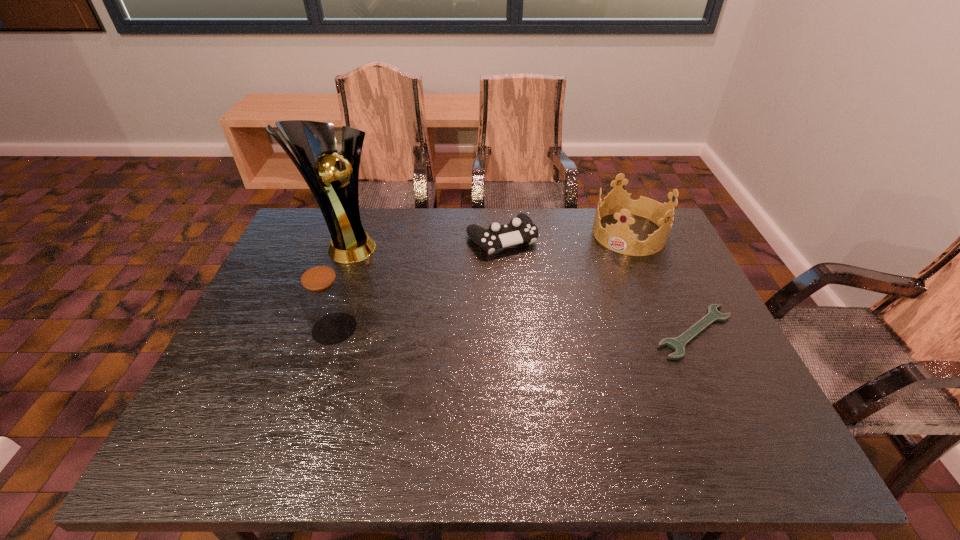
You are a GUI agent. You are given a task and a screenshot of the screen. Output one action in this format:
    pyautogui.click(x=<x>, y=<y>)
    Task: Click on the free space located at the front of the award, where the globe is visible
    This screenshot has height=540, width=960.
    Given the screenshot: What is the action you would take?
    pyautogui.click(x=451, y=313)

The width and height of the screenshot is (960, 540). What are the coordinates of `free region located on the front-facing side of the tiara` in the screenshot? It's located at (569, 319).

The image size is (960, 540). Identify the location of free space located 0.270m on the front-facing side of the tiara. (579, 305).

At what (x,y) coordinates should I click in order to perform the action: click on free spot located 0.110m on the front-facing side of the tiara. Please return your answer as a coordinate pair (x, y). Looking at the image, I should click on click(x=602, y=272).

The image size is (960, 540). What are the coordinates of `vacant space located on the surface of the second shortest object` in the screenshot? It's located at (560, 319).

Identify the location of vacant space located on the surface of the second shortest object. (584, 354).

The height and width of the screenshot is (540, 960). In order to click on vacant space located on the surface of the second shortest object in this screenshot , I will do `click(549, 304)`.

What are the coordinates of `award present at the far edge` in the screenshot? It's located at (313, 143).

At what (x,y) coordinates should I click in order to perform the action: click on tiara positioned at the far edge. Please return your answer as a coordinate pair (x, y). The image size is (960, 540). Looking at the image, I should click on (618, 237).

This screenshot has height=540, width=960. I want to click on control at the far edge, so click(x=521, y=229).